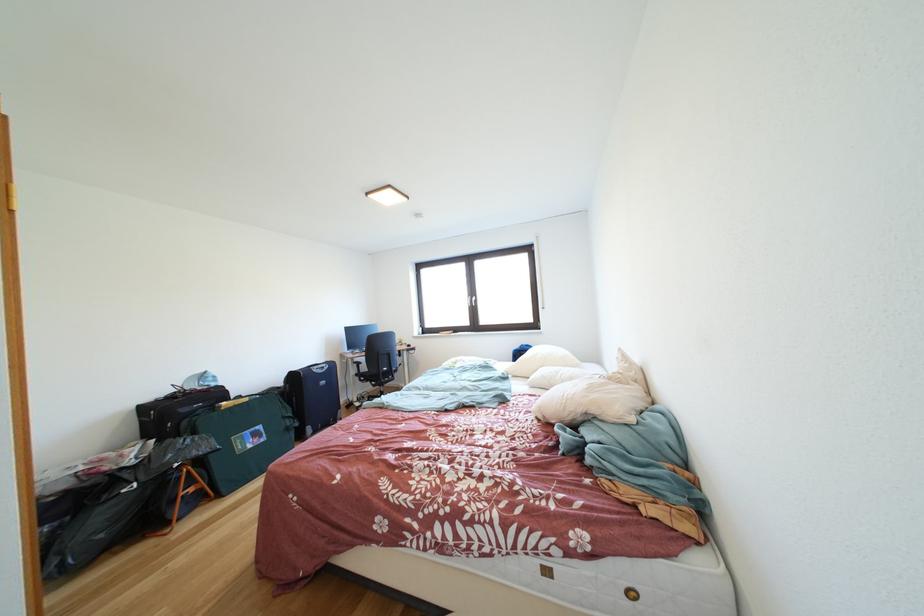
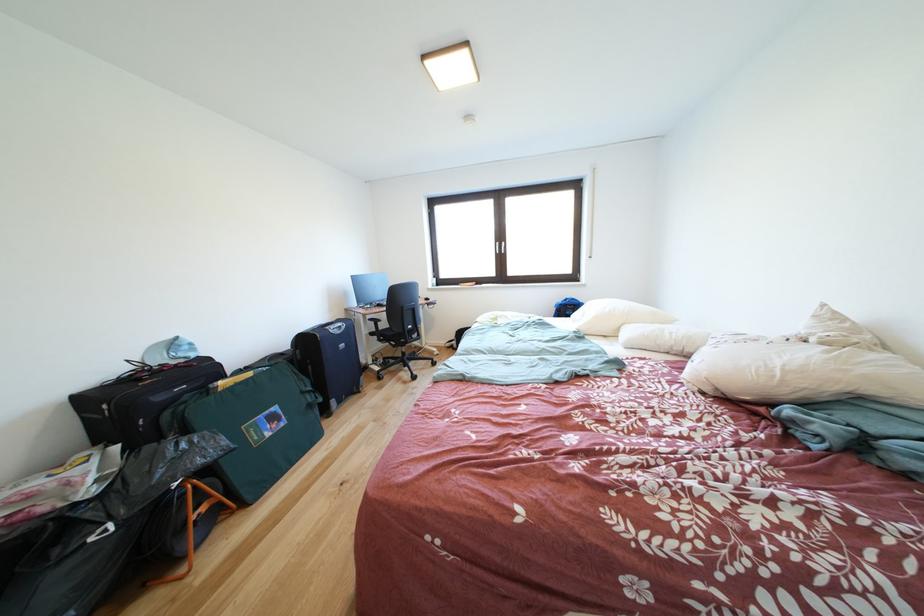
Find the pixel in the second image that matches the point at 365,379 in the first image.

(380, 339)